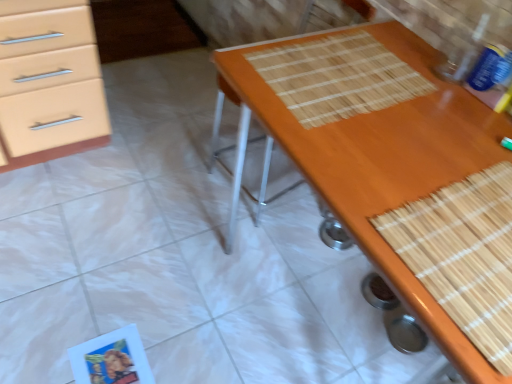
Find the location of a particular element. free location above wooden desk at center (from a real-world perspective) is located at coordinates (410, 133).